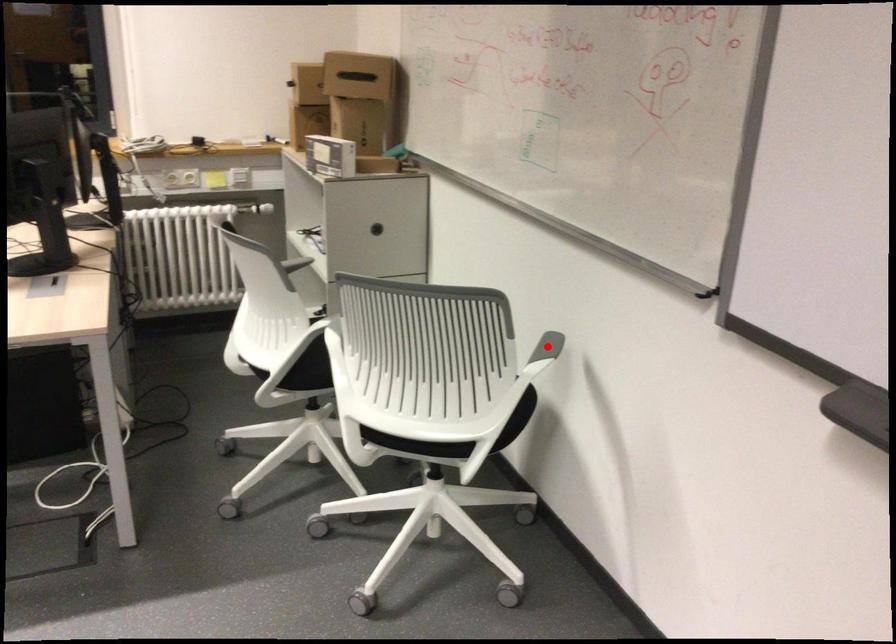
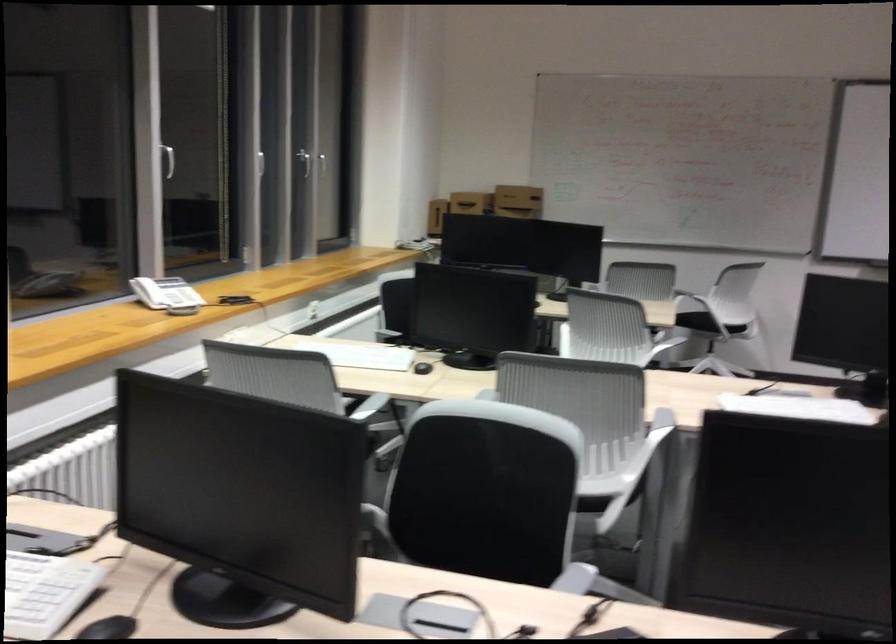
Question: I am providing you with two images of the same scene from different viewpoints. A red point is marked on the first image. At the location where the point appears in image 1, is it still visible in image 2?

Choices:
 (A) Yes
 (B) No

Answer: (B)